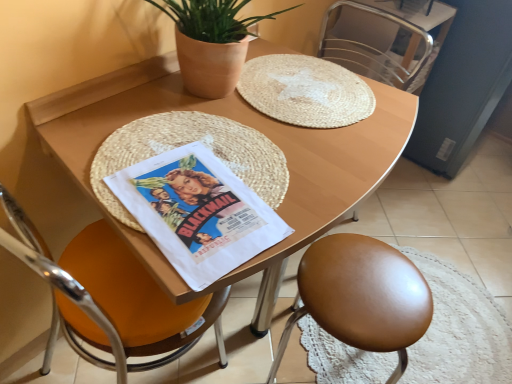
Identify the location of vacant space behind white paper comic book at center. The width and height of the screenshot is (512, 384). (246, 124).